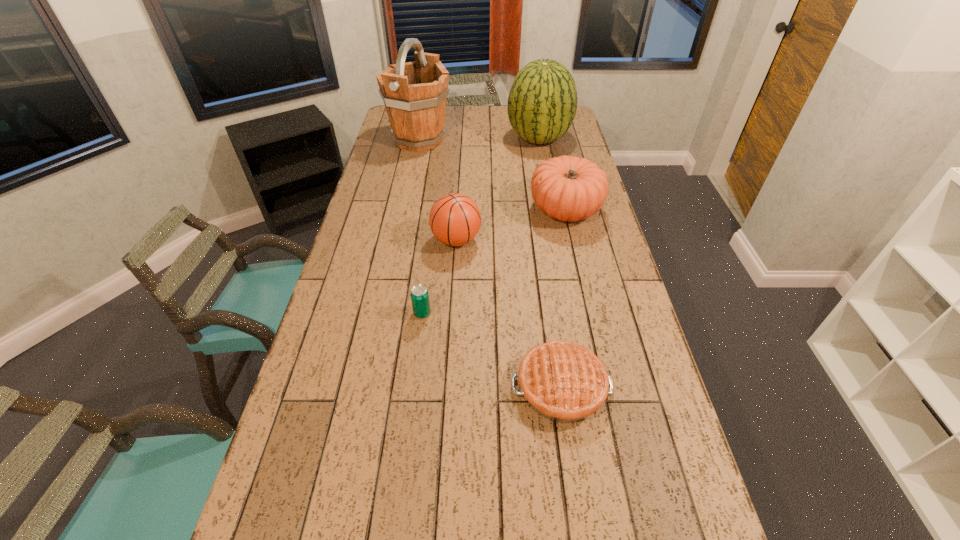
At what (x,y) coordinates should I click in order to perform the action: click on vacant space at the far edge of the desktop. Please return your answer as a coordinate pair (x, y). Looking at the image, I should click on (501, 113).

Find the location of a particular element. This screenshot has width=960, height=540. free space at the left edge of the desktop is located at coordinates (350, 260).

Identify the location of vacant area that lies between the tallest object and the nearest object. (490, 264).

Where is `vacant area between the nearest object and the second tallest object`? vacant area between the nearest object and the second tallest object is located at coordinates (550, 263).

Find the location of a particular element. The width and height of the screenshot is (960, 540). unoccupied position between the pumpkin and the bucket is located at coordinates (492, 175).

Locate an element on the screen. This screenshot has height=540, width=960. free space between the watermelon and the tallest object is located at coordinates (479, 140).

The width and height of the screenshot is (960, 540). I want to click on vacant area between the pie and the basketball, so click(509, 314).

Find the location of a particular element. The image size is (960, 540). free spot between the second nearest object and the nearest object is located at coordinates (492, 350).

The height and width of the screenshot is (540, 960). What are the coordinates of `free space between the fifth farthest object and the bucket` in the screenshot? It's located at (420, 227).

Image resolution: width=960 pixels, height=540 pixels. I want to click on empty space between the bucket and the pie, so click(x=490, y=264).